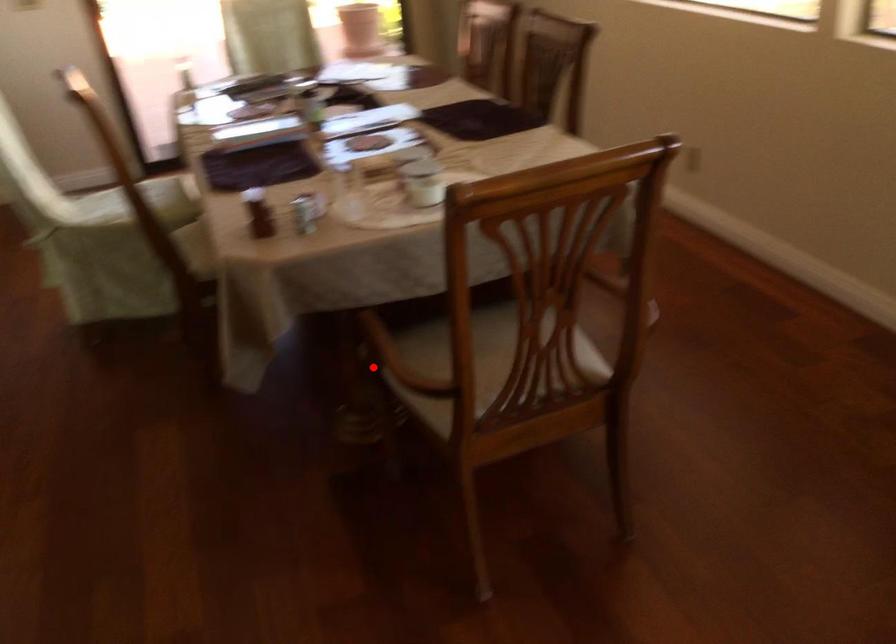
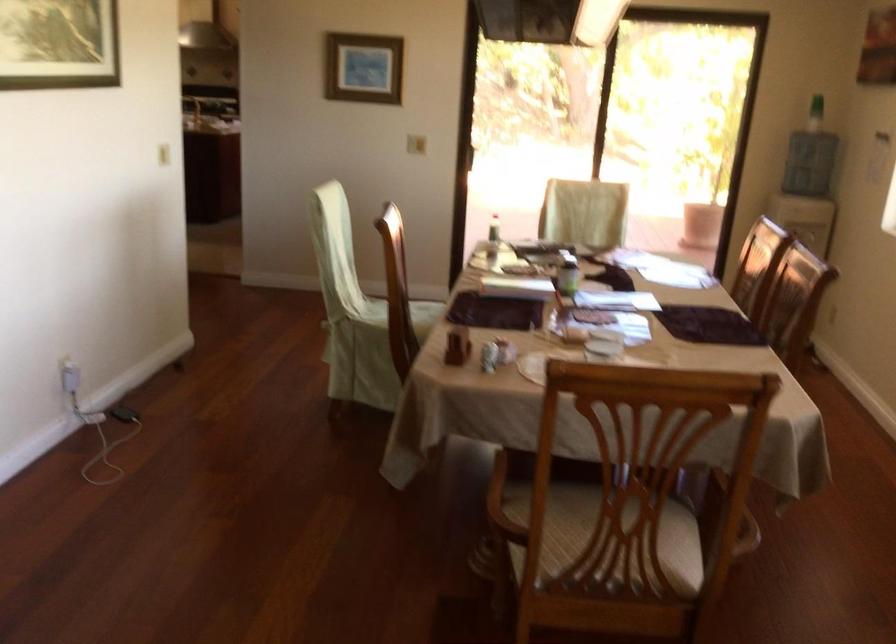
Find the pixel in the second image that matches the highlighted location in the first image.

(503, 504)